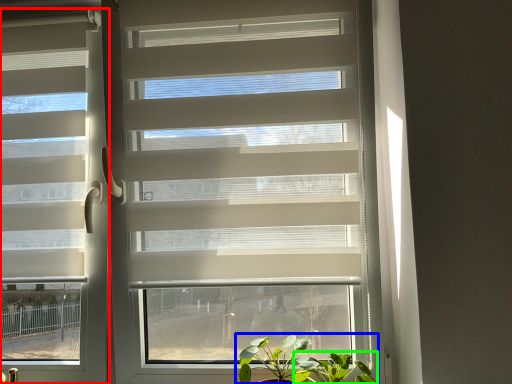
Question: Considering the real-world distances, which object is closest to window blind (highlighted by a red box)? houseplant (highlighted by a blue box) or vegetation (highlighted by a green box).

Choices:
 (A) houseplant
 (B) vegetation

Answer: (A)